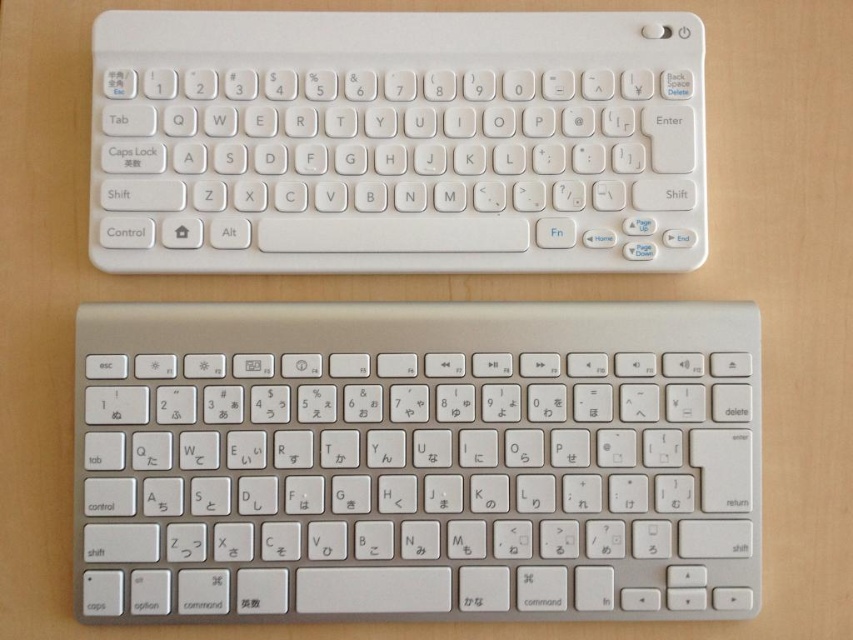
You are positioning a new monitor on the desk and want to ensure it doesn not block the satin silver keyboard at center. Based on the coordinates provided, where should you place the monitor to avoid covering the keyboard?

The satin silver keyboard at center is located at coordinates point [416,461], so placing the monitor away from this area will prevent it from blocking the keyboard.

You are setting up a desk and want to place a new monitor between the satin silver keyboard at center and the white plastic keyboard at upper center. Based on their positions, which keyboard should the monitor be placed closer to in order to maintain a balanced setup?

The satin silver keyboard at center is closer to the viewer than the white plastic keyboard at upper center, so the monitor should be placed closer to the satin silver keyboard at center to balance the distance between both keyboards.